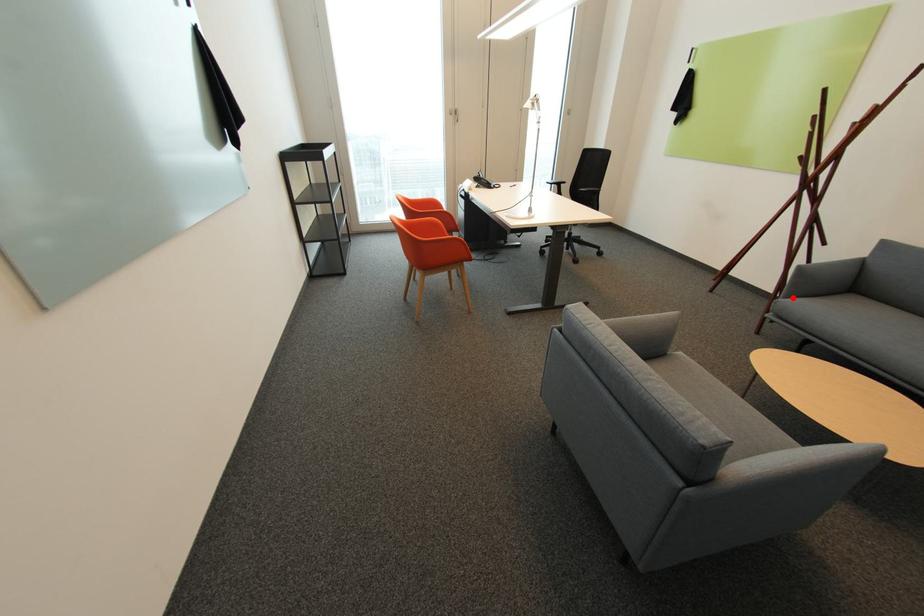
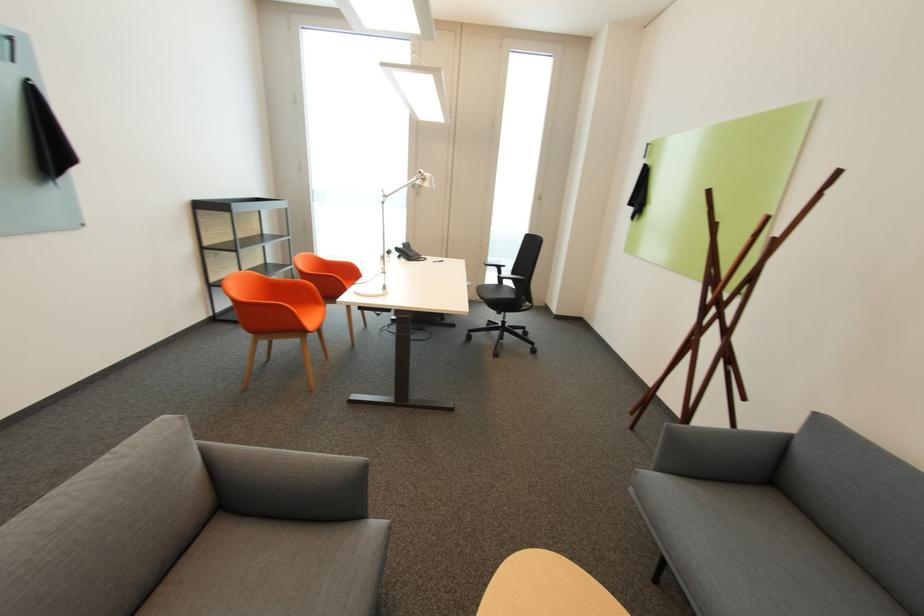
Where in the second image is the point corresponding to the highlighted location from the first image?

(663, 469)